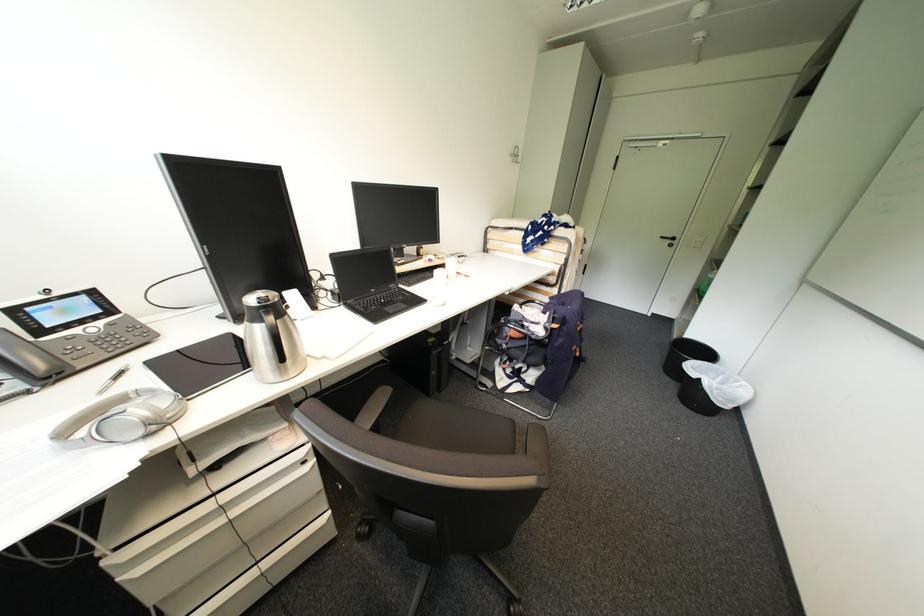
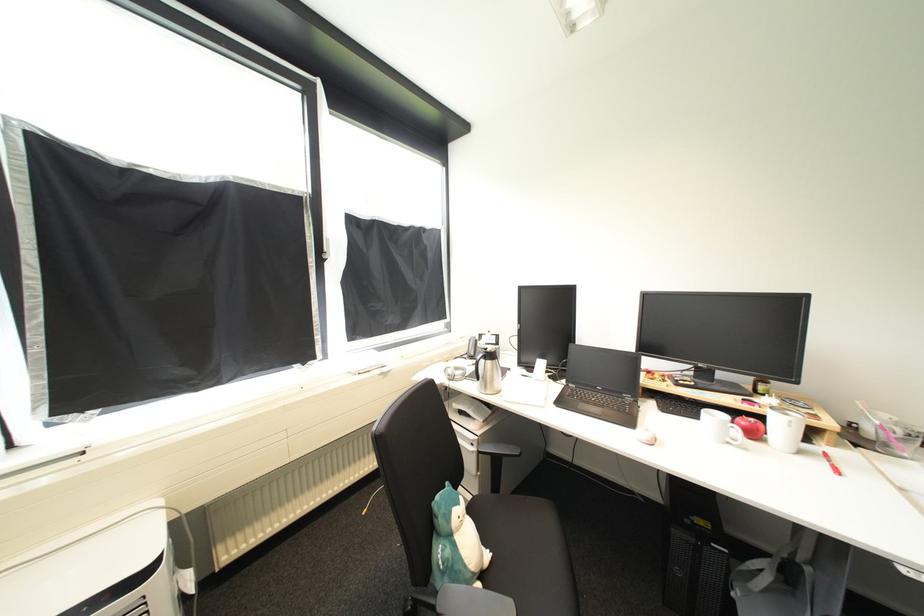
Question: Based on the continuous images, in which direction is the camera rotating? Reply with the corresponding letter.

Choices:
 (A) Left
 (B) Right
 (C) Up
 (D) Down

Answer: (A)